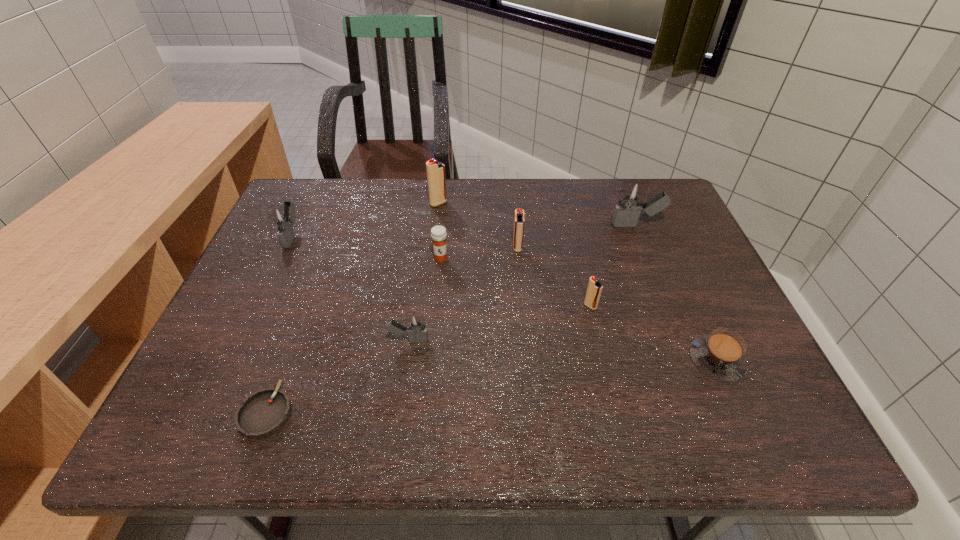
I want to click on cappuccino at the right edge, so click(721, 355).

At what (x,y) coordinates should I click in order to perform the action: click on object that is at the far left corner. Please return your answer as a coordinate pair (x, y). Looking at the image, I should click on (282, 217).

Identify the location of object located at the near left corner. (263, 413).

I want to click on object that is at the far right corner, so click(x=631, y=198).

This screenshot has height=540, width=960. I want to click on vacant region at the far edge, so click(x=550, y=200).

Image resolution: width=960 pixels, height=540 pixels. I want to click on free region at the near edge, so click(580, 435).

Locate an element on the screen. The height and width of the screenshot is (540, 960). vacant space at the left edge of the desktop is located at coordinates click(x=300, y=249).

Locate an element on the screen. The image size is (960, 540). free location at the right edge of the desktop is located at coordinates (687, 299).

Find the location of `free region at the far left corner of the desktop`. free region at the far left corner of the desktop is located at coordinates (329, 204).

At what (x,y) coordinates should I click in order to perform the action: click on vacant space in between the smallest gray igniter and the biggest gray igniter. Please return your answer as a coordinate pair (x, y). Looking at the image, I should click on (522, 283).